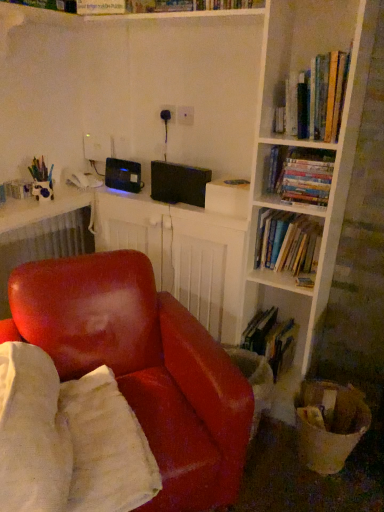
Question: From a real-world perspective, is hardcover book at lower center, arranged as the 4th book when viewed from the top, beneath hardcover books at upper right, which is counted as the fourth book, starting from the bottom?

Choices:
 (A) yes
 (B) no

Answer: (A)

Question: From a real-world perspective, is hardcover book at lower center, which is the first book in bottom-to-top order, positioned over hardcover books at upper right, which is counted as the fourth book, starting from the bottom, based on gravity?

Choices:
 (A) no
 (B) yes

Answer: (A)

Question: Does hardcover book at lower center, which is the first book in bottom-to-top order, appear on the right side of hardcover books at upper right, acting as the first book starting from the top?

Choices:
 (A) no
 (B) yes

Answer: (A)

Question: From the image's perspective, is hardcover book at lower center, arranged as the 4th book when viewed from the top, beneath hardcover books at upper right, which is counted as the fourth book, starting from the bottom?

Choices:
 (A) yes
 (B) no

Answer: (A)

Question: Considering the relative sizes of hardcover book at lower center, which is the first book in bottom-to-top order, and hardcover books at upper right, which is counted as the fourth book, starting from the bottom, in the image provided, is hardcover book at lower center, which is the first book in bottom-to-top order, wider than hardcover books at upper right, which is counted as the fourth book, starting from the bottom,?

Choices:
 (A) yes
 (B) no

Answer: (A)

Question: Does hardcover book at lower center, which is the first book in bottom-to-top order, have a larger size compared to hardcover books at upper right, acting as the first book starting from the top?

Choices:
 (A) no
 (B) yes

Answer: (A)

Question: Is black plastic computer desk at center at the back of hardcover books at upper right, acting as the first book starting from the top?

Choices:
 (A) no
 (B) yes

Answer: (A)

Question: Does hardcover books at upper right, which is counted as the fourth book, starting from the bottom, have a lesser height compared to black plastic computer desk at center?

Choices:
 (A) yes
 (B) no

Answer: (A)

Question: Can you confirm if hardcover books at upper right, acting as the first book starting from the top, is wider than black plastic computer desk at center?

Choices:
 (A) yes
 (B) no

Answer: (B)

Question: Is the position of hardcover books at upper right, acting as the first book starting from the top, less distant than that of black plastic computer desk at center?

Choices:
 (A) no
 (B) yes

Answer: (B)

Question: From a real-world perspective, is hardcover books at upper right, which is counted as the fourth book, starting from the bottom, positioned over black plastic computer desk at center based on gravity?

Choices:
 (A) no
 (B) yes

Answer: (B)

Question: Considering the relative positions of hardcover books at upper right, which is counted as the fourth book, starting from the bottom, and black plastic computer desk at center in the image provided, is hardcover books at upper right, which is counted as the fourth book, starting from the bottom, to the left of black plastic computer desk at center from the viewer's perspective?

Choices:
 (A) no
 (B) yes

Answer: (A)

Question: Is leather at center outside hardcover book at lower center, arranged as the 4th book when viewed from the top?

Choices:
 (A) no
 (B) yes

Answer: (B)